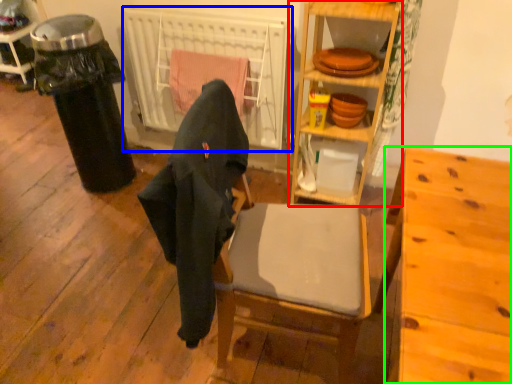
Question: Which is nearer to the shelf (highlighted by a red box)? radiator (highlighted by a blue box) or desk (highlighted by a green box).

Choices:
 (A) radiator
 (B) desk

Answer: (A)